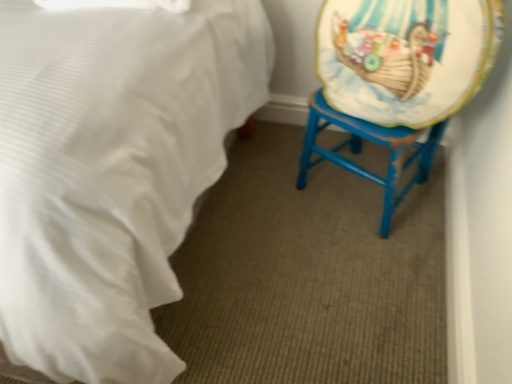
Question: Is white satin bed at lower left bigger or smaller than matte plastic platter at right?

Choices:
 (A) small
 (B) big

Answer: (B)

Question: Is white satin bed at lower left in front of or behind matte plastic platter at right in the image?

Choices:
 (A) front
 (B) behind

Answer: (A)

Question: Based on their relative distances, which object is nearer to the blue painted wood swivel chair at right?

Choices:
 (A) matte plastic platter at right
 (B) white satin bed at lower left

Answer: (A)

Question: Which of these objects is positioned farthest from the blue painted wood swivel chair at right?

Choices:
 (A) matte plastic platter at right
 (B) white satin bed at lower left

Answer: (B)